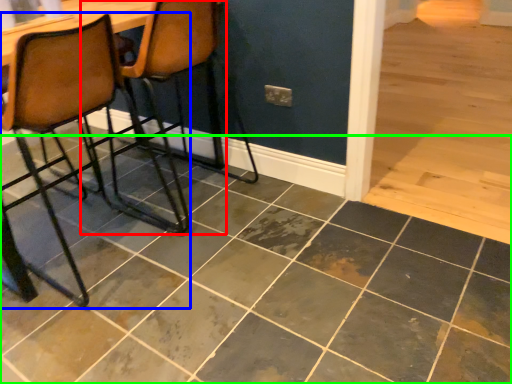
Question: Which object is positioned closest to chair (highlighted by a red box)? Select from chair (highlighted by a blue box) and ceramic tile (highlighted by a green box).

Choices:
 (A) chair
 (B) ceramic tile

Answer: (A)